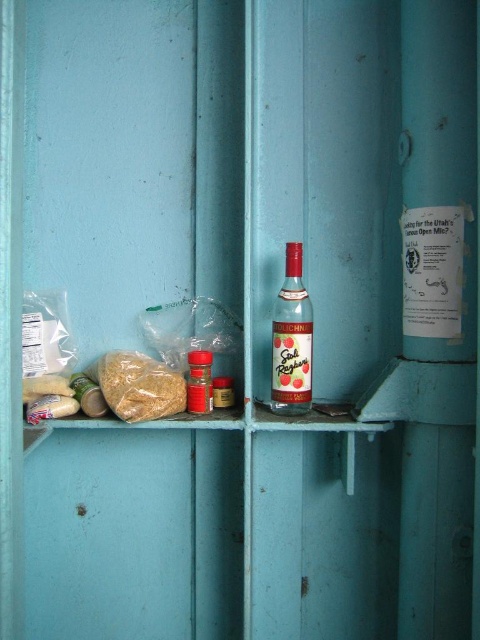
You are organizing items on a shelf and need to stack the matte glass bottle at center and the matte plastic container at center vertically. Which one should you place at the bottom to ensure stability?

The matte glass bottle at center is much taller than the matte plastic container at center, so placing it at the bottom would provide better stability due to its height and weight distribution.

You are organizing a pantry and need to move the brown matte rice at left and the matte plastic container at center. If you want to place both items on the same shelf, which item should you move first to ensure proper stacking?

The brown matte rice at left should be moved first since it is located below the matte plastic container at center, meaning it is currently underneath. To stack them properly, you should move the rice first and place it on top of the container.

You are organizing a pantry and need to place a new item between the matte glass bottle at center and the brown matte rice at left. The item is 4 inches wide. Is there enough space between them to fit the item?

The distance between the matte glass bottle at center and the brown matte rice at left is 8.41 inches. Since the new item is 4 inches wide, there is sufficient space to place it between them.